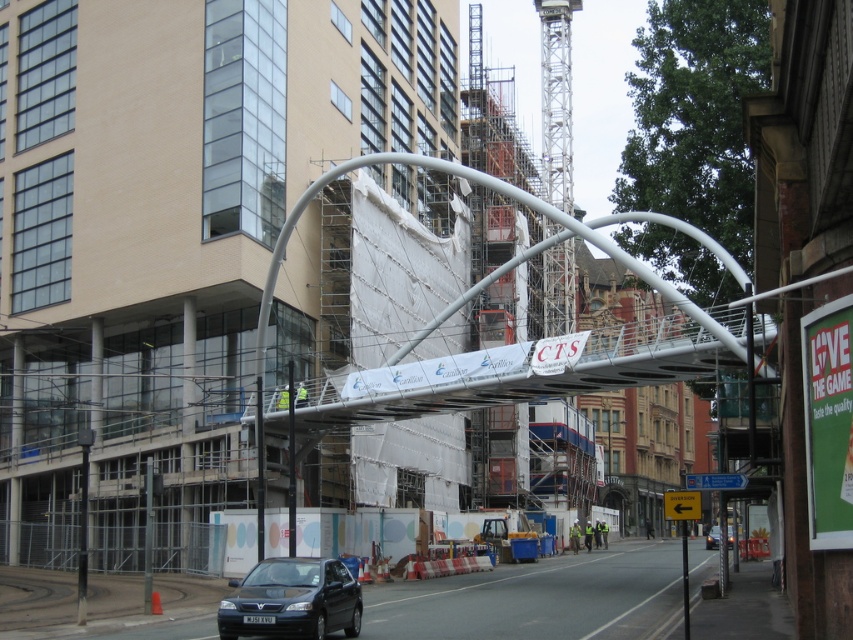
Question: Is matte black car at lower center further to camera compared to black glossy car at center?

Choices:
 (A) yes
 (B) no

Answer: (B)

Question: Is matte black car at lower center above black glossy car at center?

Choices:
 (A) yes
 (B) no

Answer: (A)

Question: Which object is closer to the camera taking this photo?

Choices:
 (A) matte black car at lower center
 (B) black glossy car at center

Answer: (A)

Question: Which object appears closest to the camera in this image?

Choices:
 (A) matte black car at lower center
 (B) black glossy car at center

Answer: (A)

Question: Is matte black car at lower center smaller than black glossy car at center?

Choices:
 (A) no
 (B) yes

Answer: (B)

Question: Which point is farther from the camera taking this photo?

Choices:
 (A) (349, 596)
 (B) (727, 532)

Answer: (B)